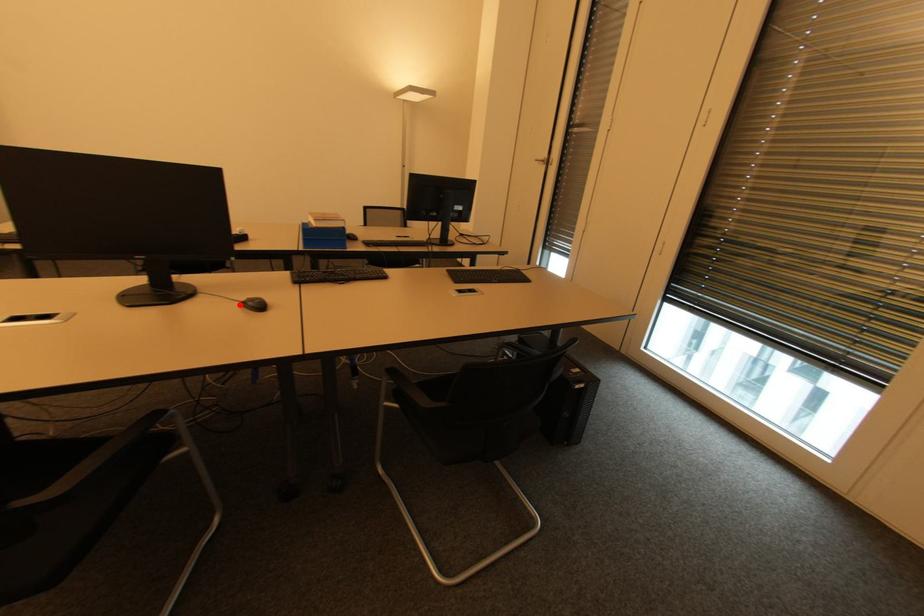
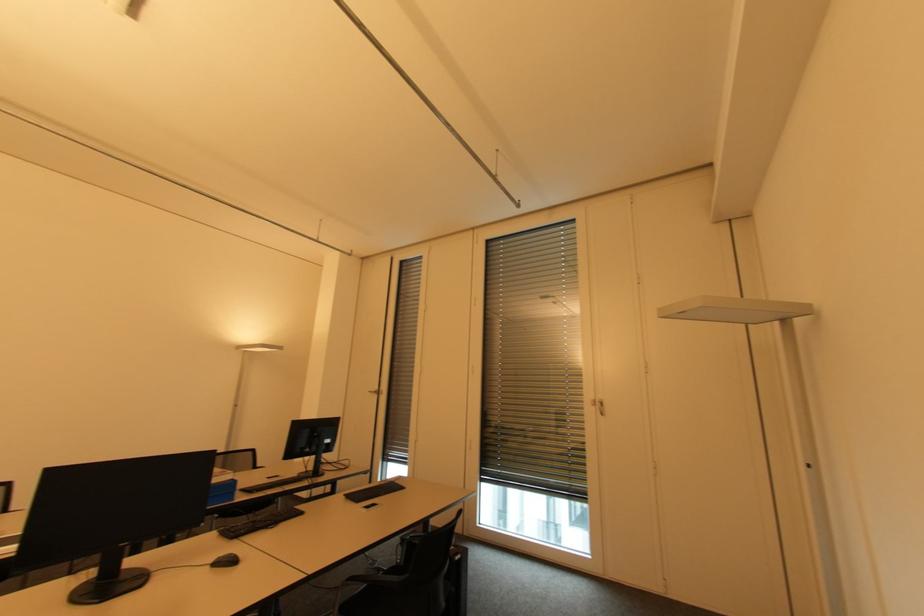
Where in the second image is the point corresponding to the highlighted location from the first image?

(210, 567)